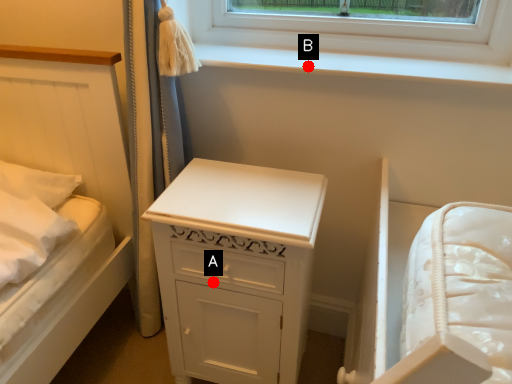
Question: Two points are circled on the image, labeled by A and B beside each circle. Which point is further to the camera?

Choices:
 (A) A is further
 (B) B is further

Answer: (B)